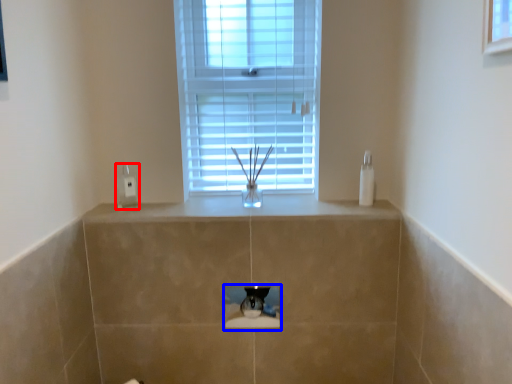
Question: Which object appears farthest to the camera in this image, electric outlet (highlighted by a red box) or hole (highlighted by a blue box)?

Choices:
 (A) electric outlet
 (B) hole

Answer: (A)